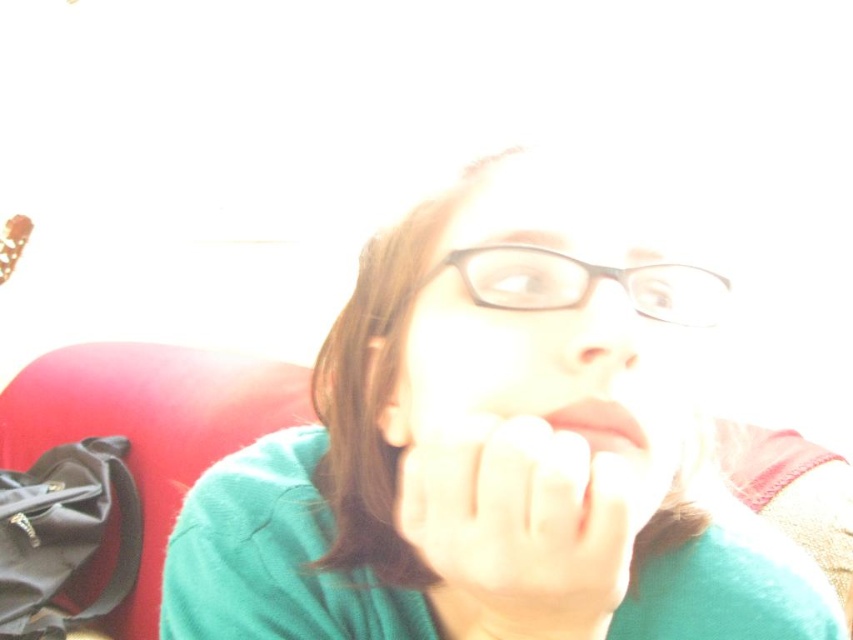
Between point (712, 506) and point (538, 291), which one is positioned behind?

The point (712, 506) is more distant.

What do you see at coordinates (491, 451) in the screenshot? Image resolution: width=853 pixels, height=640 pixels. I see `green matte sweater at center` at bounding box center [491, 451].

You are a GUI agent. You are given a task and a screenshot of the screen. Output one action in this format:
    pyautogui.click(x=<x>, y=<y>)
    Task: Click on the green matte sweater at center
    The height and width of the screenshot is (640, 853).
    Given the screenshot: What is the action you would take?
    pyautogui.click(x=491, y=451)

Is smooth skin hand at center positioned in front of matte skin nose at center?

That is True.

Is point (532, 442) less distant than point (573, 337)?

Yes.

Find the location of `smooth skin hand at center`. smooth skin hand at center is located at coordinates (520, 525).

Can you confirm if smooth skin hand at center is positioned to the left of transparent plastic glasses at center?

Correct, you'll find smooth skin hand at center to the left of transparent plastic glasses at center.

Who is shorter, smooth skin hand at center or transparent plastic glasses at center?

Standing shorter between the two is transparent plastic glasses at center.

Who is more forward, (535, 529) or (705, 273)?

Point (535, 529)

This screenshot has height=640, width=853. What are the coordinates of `smooth skin hand at center` in the screenshot? It's located at (520, 525).